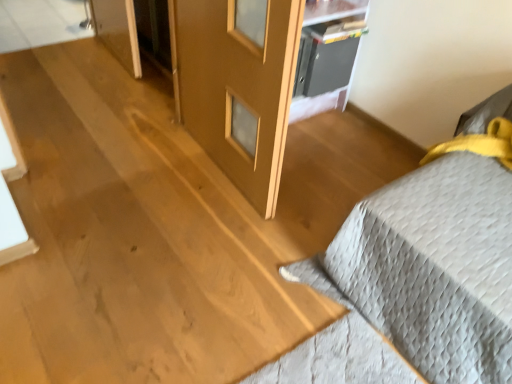
The image size is (512, 384). Identify the location of free region on the left part of gray quilted bedspread at right. point(219,263).